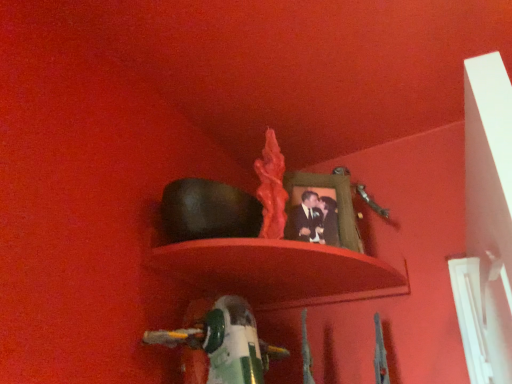
Question: Is smooth matte shelf at center facing towards matte green picture frame at upper center?

Choices:
 (A) yes
 (B) no

Answer: (B)

Question: From the image's perspective, is smooth matte shelf at center below matte green picture frame at upper center?

Choices:
 (A) yes
 (B) no

Answer: (A)

Question: Is smooth matte shelf at center to the right of matte green picture frame at upper center from the viewer's perspective?

Choices:
 (A) yes
 (B) no

Answer: (B)

Question: Can you confirm if smooth matte shelf at center is bigger than matte green picture frame at upper center?

Choices:
 (A) yes
 (B) no

Answer: (A)

Question: Is smooth matte shelf at center further to camera compared to matte green picture frame at upper center?

Choices:
 (A) yes
 (B) no

Answer: (B)

Question: In the image, is matte green picture frame at upper center on the left side or the right side of green plastic toy at lower center?

Choices:
 (A) right
 (B) left

Answer: (A)

Question: Is matte green picture frame at upper center taller or shorter than green plastic toy at lower center?

Choices:
 (A) short
 (B) tall

Answer: (B)

Question: Considering the positions of matte green picture frame at upper center and green plastic toy at lower center in the image, is matte green picture frame at upper center wider or thinner than green plastic toy at lower center?

Choices:
 (A) wide
 (B) thin

Answer: (B)

Question: Is matte green picture frame at upper center in front of or behind green plastic toy at lower center in the image?

Choices:
 (A) behind
 (B) front

Answer: (A)

Question: From a real-world perspective, is matte green picture frame at upper center physically located above or below smooth matte shelf at center?

Choices:
 (A) below
 (B) above

Answer: (B)

Question: In the image, is matte green picture frame at upper center on the left side or the right side of smooth matte shelf at center?

Choices:
 (A) left
 (B) right

Answer: (B)

Question: Does point (326, 213) appear closer or farther from the camera than point (246, 244)?

Choices:
 (A) farther
 (B) closer

Answer: (A)

Question: Considering the positions of matte green picture frame at upper center and smooth matte shelf at center in the image, is matte green picture frame at upper center wider or thinner than smooth matte shelf at center?

Choices:
 (A) wide
 (B) thin

Answer: (B)

Question: In terms of size, does green plastic toy at lower center appear bigger or smaller than matte green picture frame at upper center?

Choices:
 (A) small
 (B) big

Answer: (B)

Question: In the image, is green plastic toy at lower center positioned in front of or behind matte green picture frame at upper center?

Choices:
 (A) behind
 (B) front

Answer: (B)